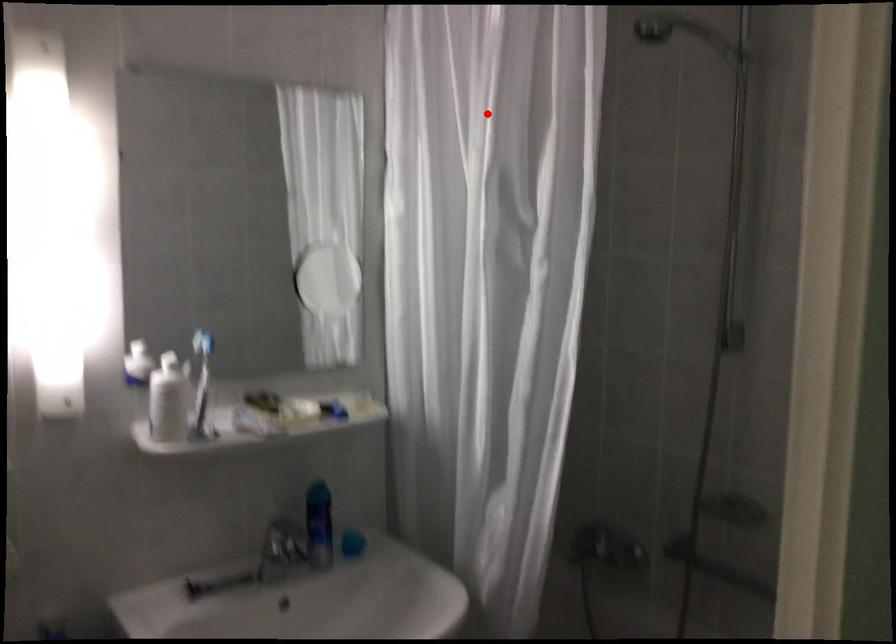
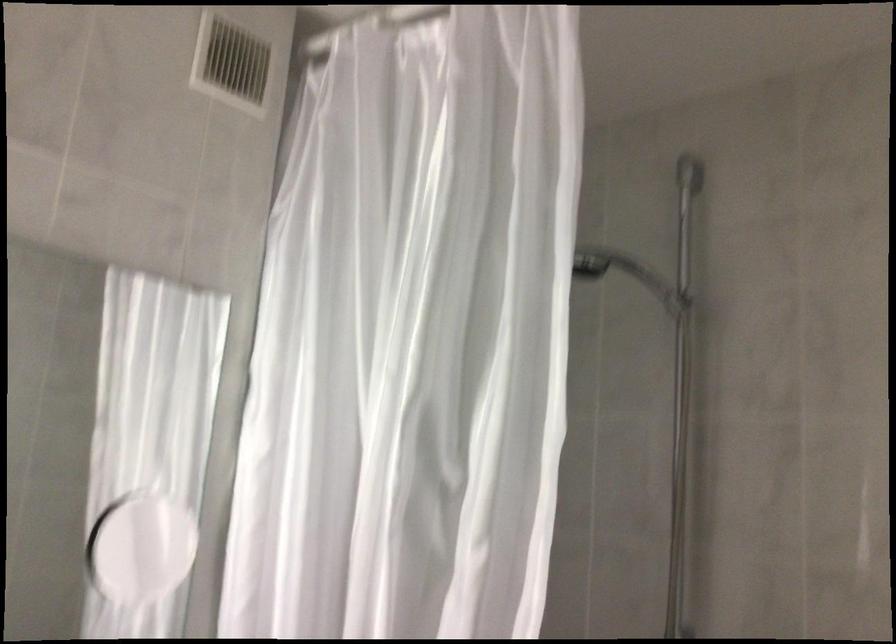
Question: I am providing you with two images of the same scene from different viewpoints. A red point is marked on the first image. Is the red point's position out of view in image 2?

Choices:
 (A) Yes
 (B) No

Answer: (B)